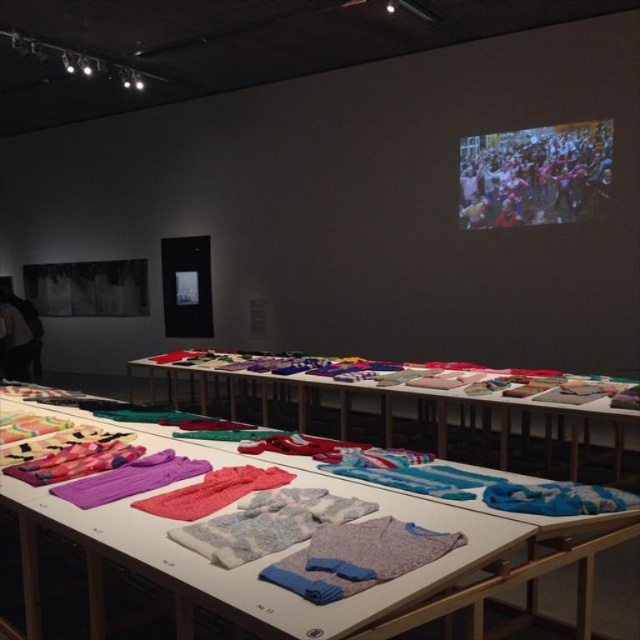
Is purple knitwear at left positioned before red knit sweater at upper right?

No, it is behind red knit sweater at upper right.

The width and height of the screenshot is (640, 640). Identify the location of purple knitwear at left. (16, 342).

In order to click on purple knitwear at left in this screenshot , I will do click(x=16, y=342).

Does textured fabric shirts at center appear under red knit sweater at upper right?

Indeed, textured fabric shirts at center is positioned under red knit sweater at upper right.

Find the location of a particular element. textured fabric shirts at center is located at coordinates (618, 593).

Who is more forward, (481, 224) or (508, 220)?

Point (508, 220)

Where is `fluffy pink scarf at center`? The image size is (640, 640). fluffy pink scarf at center is located at coordinates (474, 214).